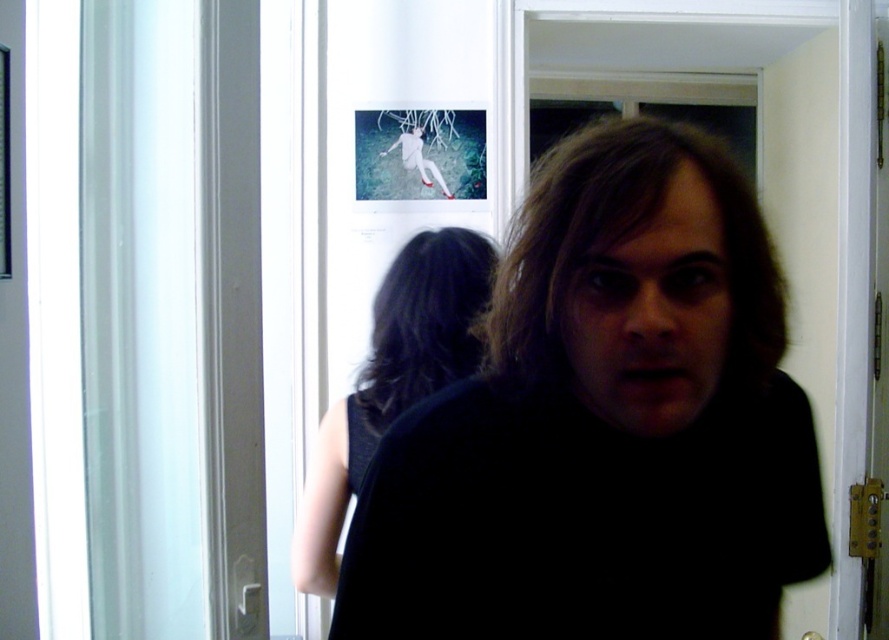
Is dark brown hair at center taller than white matte figure at center?

Yes.

Where is `dark brown hair at center`? dark brown hair at center is located at coordinates (423, 321).

This screenshot has width=889, height=640. I want to click on dark brown hair at center, so 423,321.

Identify the location of brown matte hair at center. (x=639, y=278).

Is black fabric at center thinner than black fabric dress at center?

Incorrect, black fabric at center's width is not less than black fabric dress at center's.

Is black fabric at center above black fabric dress at center?

Yes.

You are a GUI agent. You are given a task and a screenshot of the screen. Output one action in this format:
    pyautogui.click(x=<x>, y=<y>)
    Task: Click on the black fabric at center
    Image resolution: width=889 pixels, height=640 pixels.
    Given the screenshot: What is the action you would take?
    pyautogui.click(x=605, y=422)